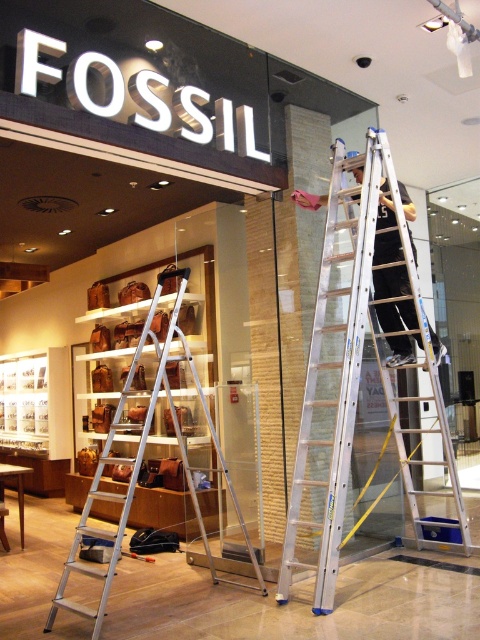
Question: Considering the real-world distances, which object is farthest from the dark gray fabric pants at center?

Choices:
 (A) silver metallic ladder at center
 (B) silver metallic ladder at upper right

Answer: (A)

Question: Is silver metallic ladder at upper right further to the viewer compared to silver metallic ladder at center?

Choices:
 (A) yes
 (B) no

Answer: (B)

Question: Is silver metallic ladder at upper right to the right of dark gray fabric pants at center from the viewer's perspective?

Choices:
 (A) yes
 (B) no

Answer: (B)

Question: Which point appears farthest from the camera in this image?

Choices:
 (A) (451, 456)
 (B) (396, 333)
 (C) (155, 307)

Answer: (B)

Question: Among these objects, which one is farthest from the camera?

Choices:
 (A) dark gray fabric pants at center
 (B) silver metallic ladder at upper right

Answer: (A)

Question: Observing the image, what is the correct spatial positioning of silver metallic ladder at upper right in reference to silver metallic ladder at center?

Choices:
 (A) above
 (B) below

Answer: (A)